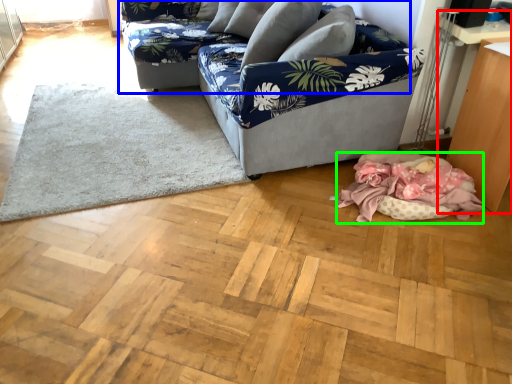
Question: Which is farther away from table (highlighted by a red box)? studio couch (highlighted by a blue box) or blanket (highlighted by a green box)?

Choices:
 (A) studio couch
 (B) blanket

Answer: (A)